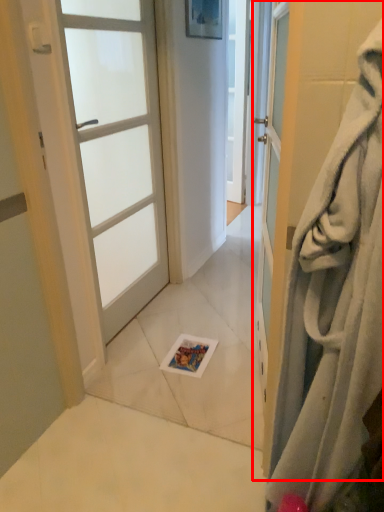
Question: In this image, where is door (annotated by the red box) located relative to door?

Choices:
 (A) right
 (B) left

Answer: (A)